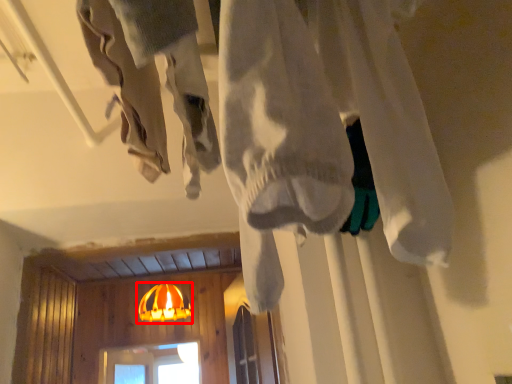
Question: From the image's perspective, considering the relative positions of lamp (annotated by the red box) and clothing in the image provided, where is lamp (annotated by the red box) located with respect to the staircase?

Choices:
 (A) below
 (B) above

Answer: (A)